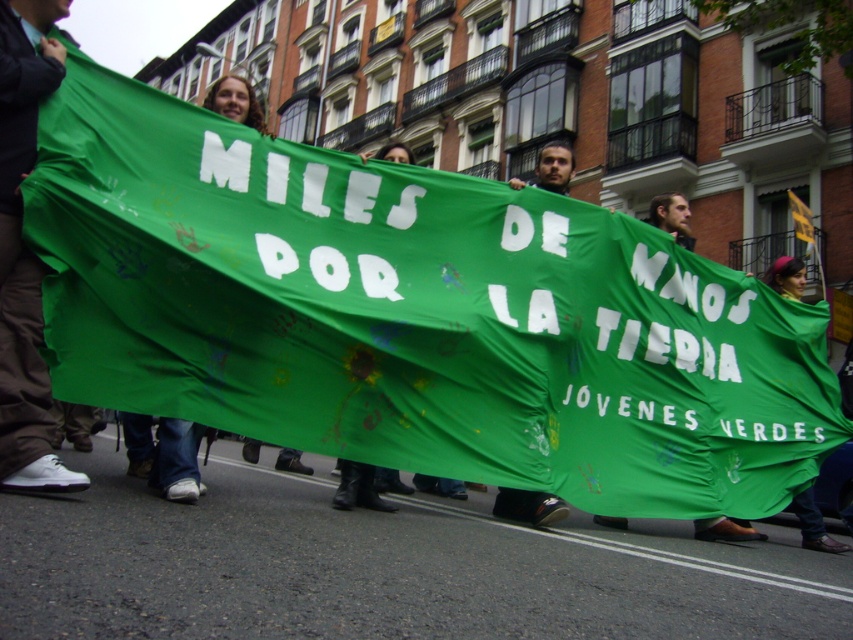
You are a photographer trying to capture the protest scene. You notice the white matte shoe at lower left and the green fabric banner at center. Which object is positioned lower in the image?

The white matte shoe at lower left is located below the green fabric banner at center, so it is positioned lower in the image.

You are a photographer standing at the edge of the protest scene. You want to take a photo that includes both the white matte shoe at lower left and the green fabric banner at center. Given that your camera has a maximum focus range of 10 feet, will you be able to capture both objects in focus without moving your position?

The white matte shoe at lower left and green fabric banner at center are 9.76 feet apart, so yes, the camera can capture both objects in focus since the distance between them is within the 10 feet range.

You are a photographer standing on the sidewalk trying to capture the protest scene. You want to ensure both the white matte shoe at lower left and the green fabric banner at center are in the frame. Based on their positions, which object should you focus on first to include both in your shot?

The white matte shoe at lower left is positioned on the left side of the green fabric banner at center. To include both in your shot, focus on the green fabric banner at center first as it is centrally located and the shoe is to its left, ensuring both are within the frame when centered.